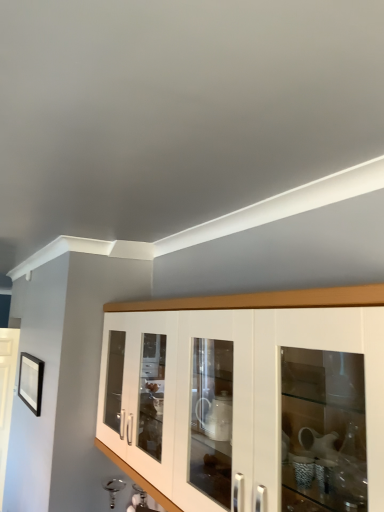
Question: From the image's perspective, does white glossy cabinet at center appear lower than black matte picture frame at upper left?

Choices:
 (A) yes
 (B) no

Answer: (B)

Question: Can you confirm if white glossy cabinet at center is positioned to the left of black matte picture frame at upper left?

Choices:
 (A) yes
 (B) no

Answer: (B)

Question: Is white glossy cabinet at center positioned in front of black matte picture frame at upper left?

Choices:
 (A) yes
 (B) no

Answer: (A)

Question: Would you consider white glossy cabinet at center to be distant from black matte picture frame at upper left?

Choices:
 (A) yes
 (B) no

Answer: (A)

Question: Does white glossy cabinet at center have a lesser width compared to black matte picture frame at upper left?

Choices:
 (A) yes
 (B) no

Answer: (B)

Question: Does white glossy cabinet at center touch black matte picture frame at upper left?

Choices:
 (A) yes
 (B) no

Answer: (B)

Question: From a real-world perspective, is black matte picture frame at upper left physically below white glossy cabinet at center?

Choices:
 (A) yes
 (B) no

Answer: (A)

Question: Could you tell me if black matte picture frame at upper left is turned towards white glossy cabinet at center?

Choices:
 (A) yes
 (B) no

Answer: (B)

Question: From the image's perspective, would you say black matte picture frame at upper left is positioned over white glossy cabinet at center?

Choices:
 (A) yes
 (B) no

Answer: (B)

Question: From the image's perspective, is black matte picture frame at upper left under white glossy cabinet at center?

Choices:
 (A) no
 (B) yes

Answer: (B)

Question: Is black matte picture frame at upper left touching white glossy cabinet at center?

Choices:
 (A) no
 (B) yes

Answer: (A)

Question: Considering the relative positions of black matte picture frame at upper left and white glossy cabinet at center in the image provided, is black matte picture frame at upper left to the right of white glossy cabinet at center from the viewer's perspective?

Choices:
 (A) yes
 (B) no

Answer: (B)

Question: From the image's perspective, is white glossy cabinet at center located above or below black matte picture frame at upper left?

Choices:
 (A) above
 (B) below

Answer: (A)